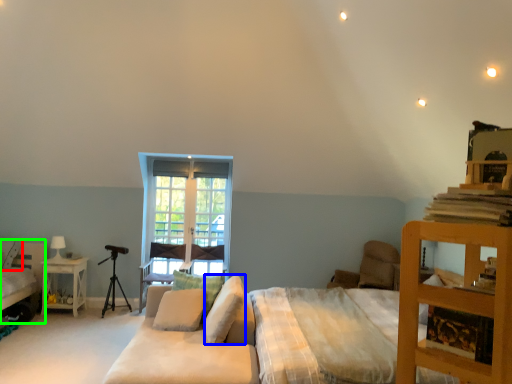
Question: Which is farther away from pillow (highlighted by a red box)? pillow (highlighted by a blue box) or bed (highlighted by a green box)?

Choices:
 (A) pillow
 (B) bed

Answer: (A)